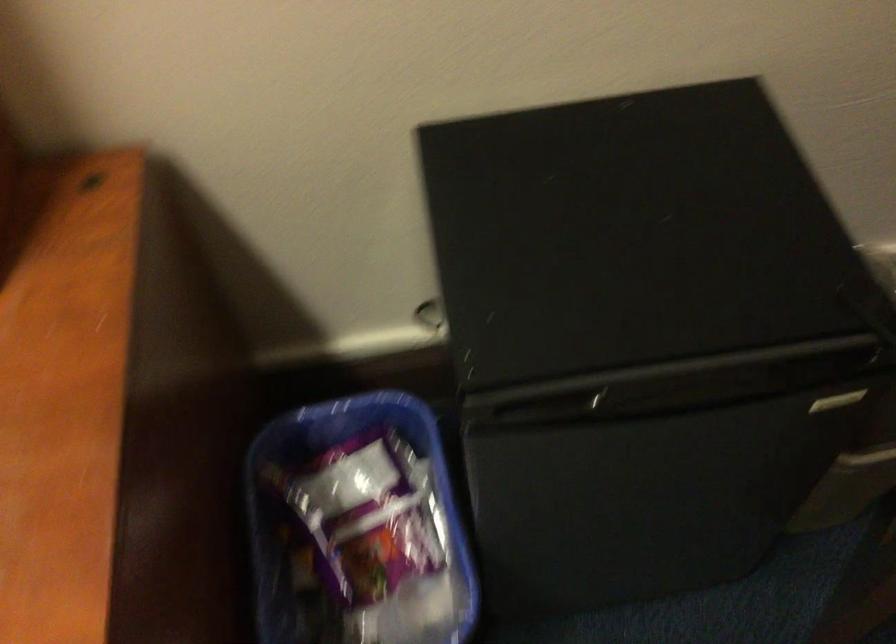
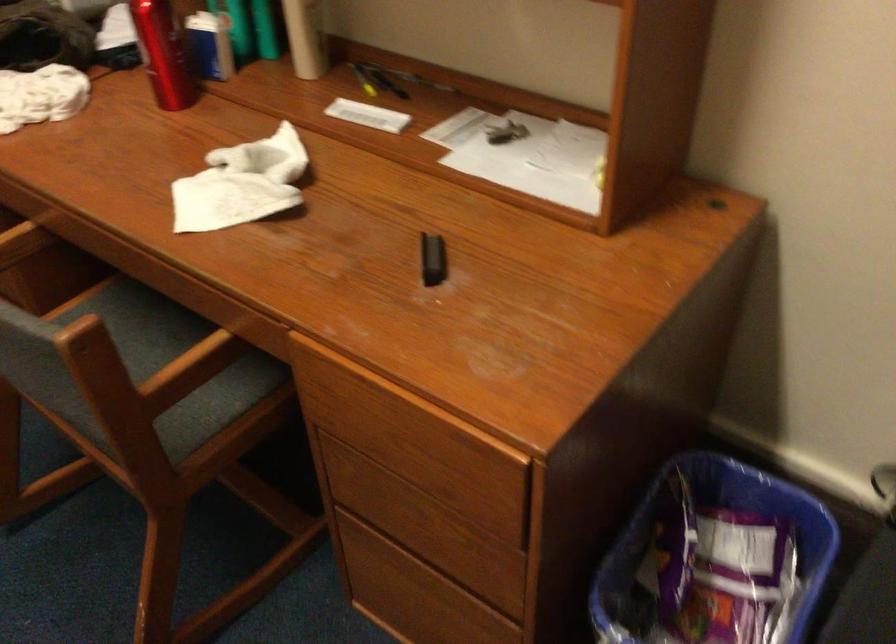
In the second image, find the point that corresponds to the point at 340,489 in the first image.

(711, 542)